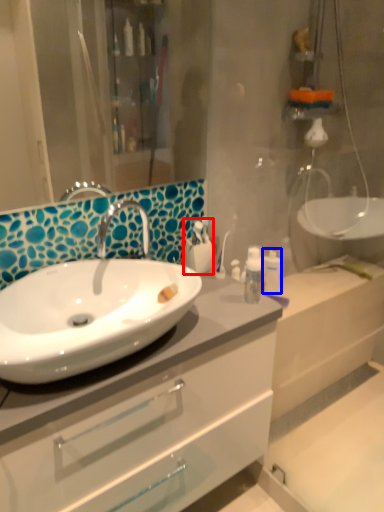
Question: Among these objects, which one is nearest to the camera, toiletry (highlighted by a red box) or toiletry (highlighted by a blue box)?

Choices:
 (A) toiletry
 (B) toiletry

Answer: (A)